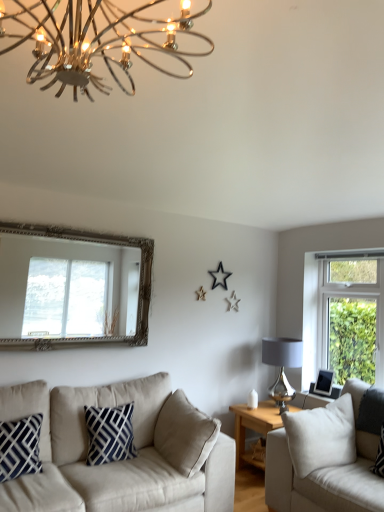
Find the location of a particular element. This screenshot has width=384, height=512. blank space situated above silver ornate mirror at upper left (from a real-world perspective) is located at coordinates (79, 232).